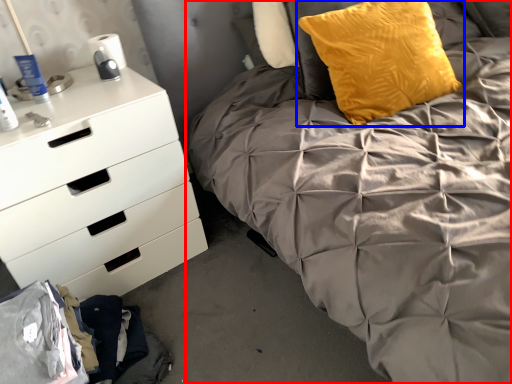
Question: Which object appears farthest to the camera in this image, bed (highlighted by a red box) or pillow (highlighted by a blue box)?

Choices:
 (A) bed
 (B) pillow

Answer: (B)